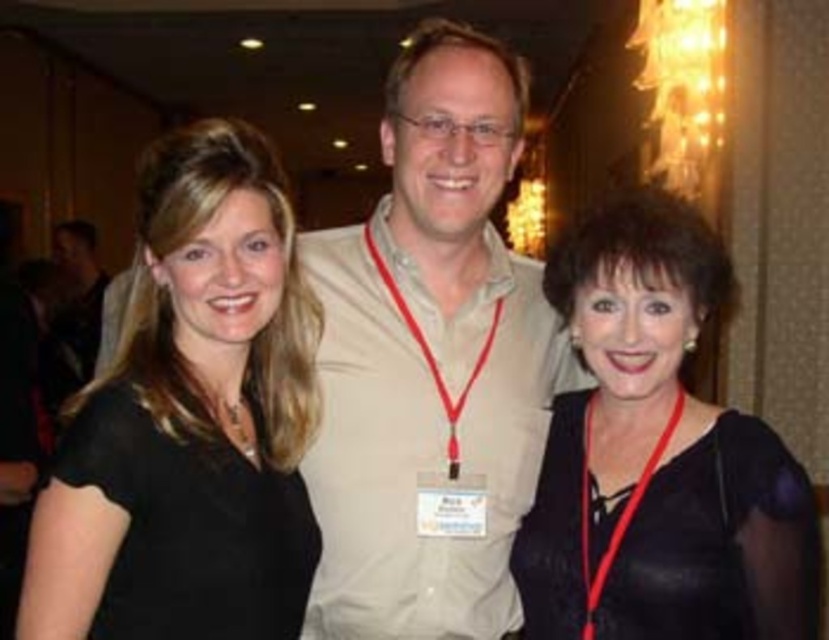
Question: Which object appears farthest from the camera in this image?

Choices:
 (A) black leather dress at right
 (B) black matte shirt at left
 (C) beige cotton shirt at center

Answer: (C)

Question: Can you confirm if beige cotton shirt at center is smaller than black matte shirt at left?

Choices:
 (A) no
 (B) yes

Answer: (A)

Question: Is beige cotton shirt at center above black matte shirt at left?

Choices:
 (A) no
 (B) yes

Answer: (B)

Question: Which of the following is the farthest from the observer?

Choices:
 (A) black leather dress at right
 (B) black matte shirt at left
 (C) beige cotton shirt at center

Answer: (C)

Question: Can you confirm if black matte shirt at left is wider than black leather dress at right?

Choices:
 (A) yes
 (B) no

Answer: (B)

Question: Among these points, which one is farthest from the camera?

Choices:
 (A) (197, 627)
 (B) (488, 131)
 (C) (606, 593)

Answer: (B)